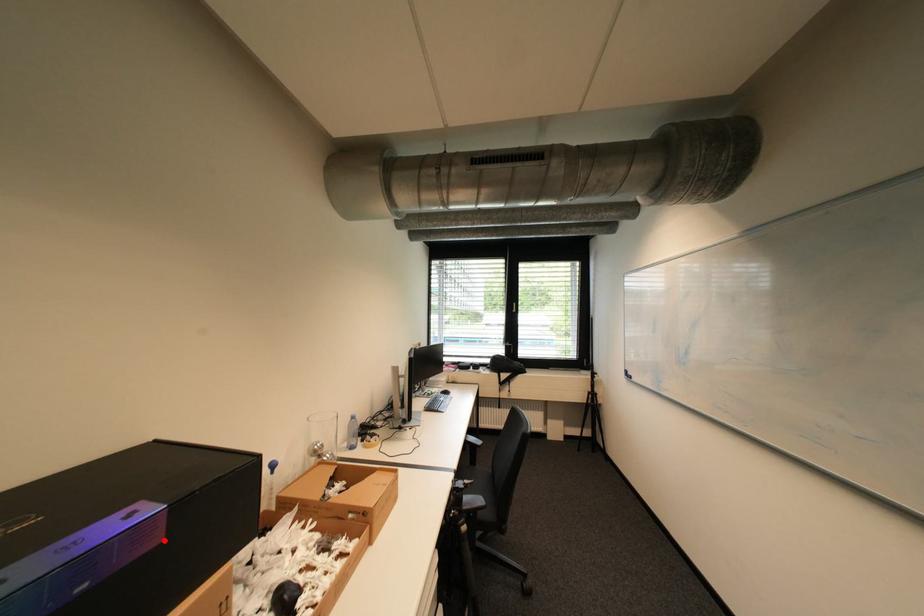
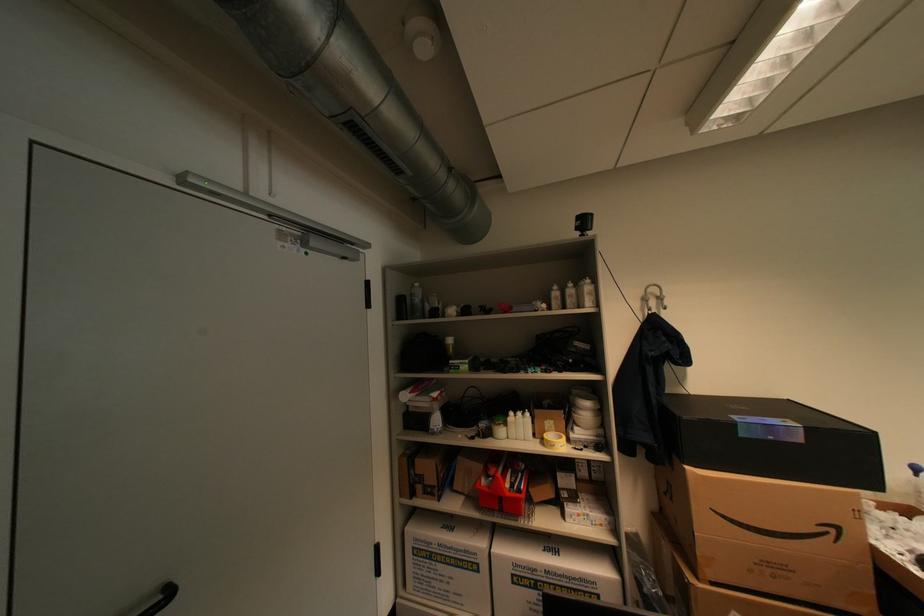
Question: I am providing you with two images of the same scene from different viewpoints. In image1, a red point is highlighted. Considering the same 3D point in image2, which of the following is correct?

Choices:
 (A) It is closer
 (B) It is farther

Answer: (A)